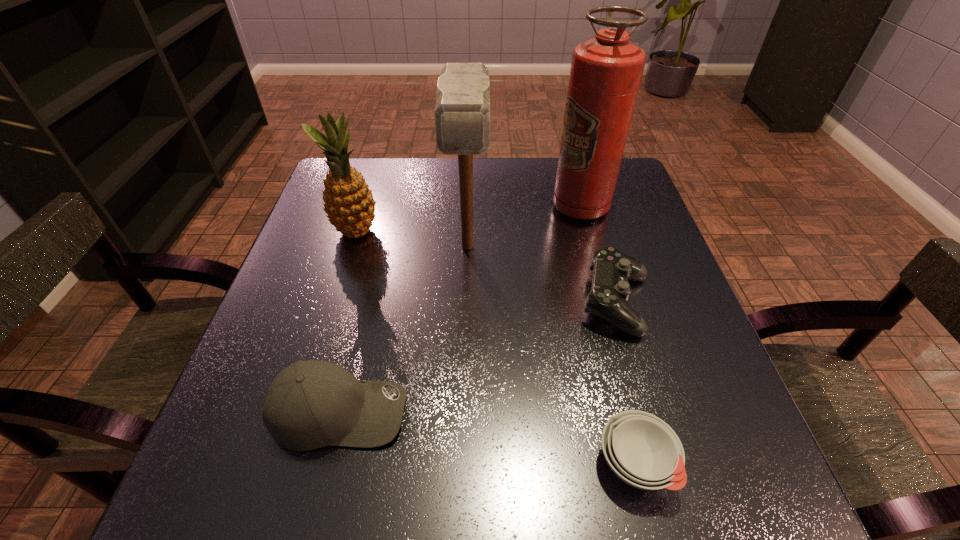
You are a GUI agent. You are given a task and a screenshot of the screen. Output one action in this format:
    pyautogui.click(x=<x>, y=<y>)
    Task: Click on the fire extinguisher
    This screenshot has width=960, height=540.
    Given the screenshot: What is the action you would take?
    pyautogui.click(x=606, y=72)

Where is `the second tallest object`? the second tallest object is located at coordinates [462, 112].

Identify the location of the fourth object from right to left. (462, 112).

Find the location of `pineapple`. pineapple is located at coordinates (349, 203).

Image resolution: width=960 pixels, height=540 pixels. What are the coordinates of `baseball cap` in the screenshot? It's located at (311, 404).

Locate an element on the screen. the second shortest object is located at coordinates (610, 292).

You are a GUI agent. You are given a task and a screenshot of the screen. Output one action in this format:
    pyautogui.click(x=<x>, y=<y>)
    Task: Click on the shortest object
    The width and height of the screenshot is (960, 540).
    Given the screenshot: What is the action you would take?
    pyautogui.click(x=642, y=450)

I want to click on free space located 0.220m on the label side of the fire extinguisher, so click(465, 206).

At what (x,y) coordinates should I click in order to perform the action: click on free location located on the label side of the fire extinguisher. Please return your answer as a coordinate pair (x, y). This screenshot has width=960, height=540. Looking at the image, I should click on (505, 206).

The height and width of the screenshot is (540, 960). Find the location of `free region located 0.270m on the label side of the fire extinguisher`. free region located 0.270m on the label side of the fire extinguisher is located at coordinates tap(445, 206).